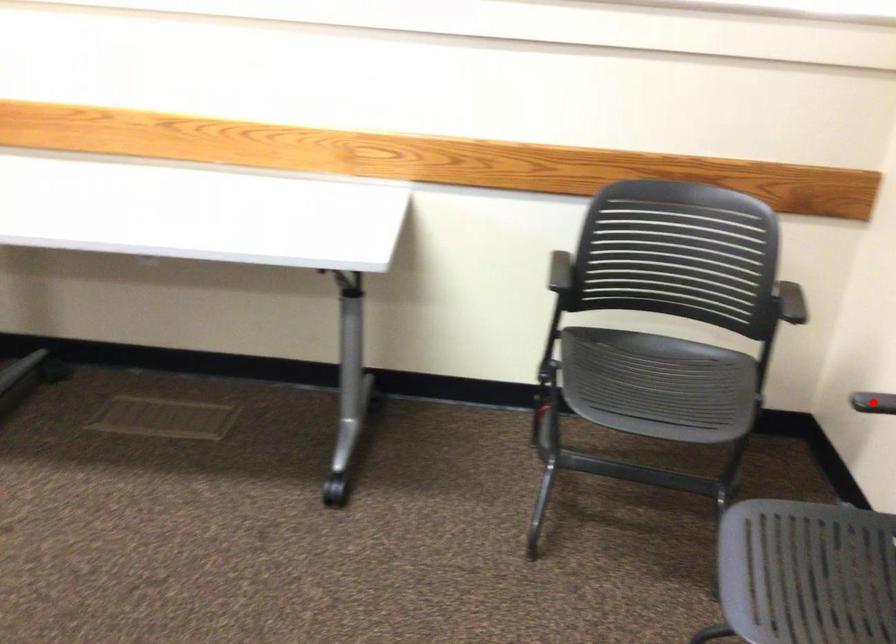
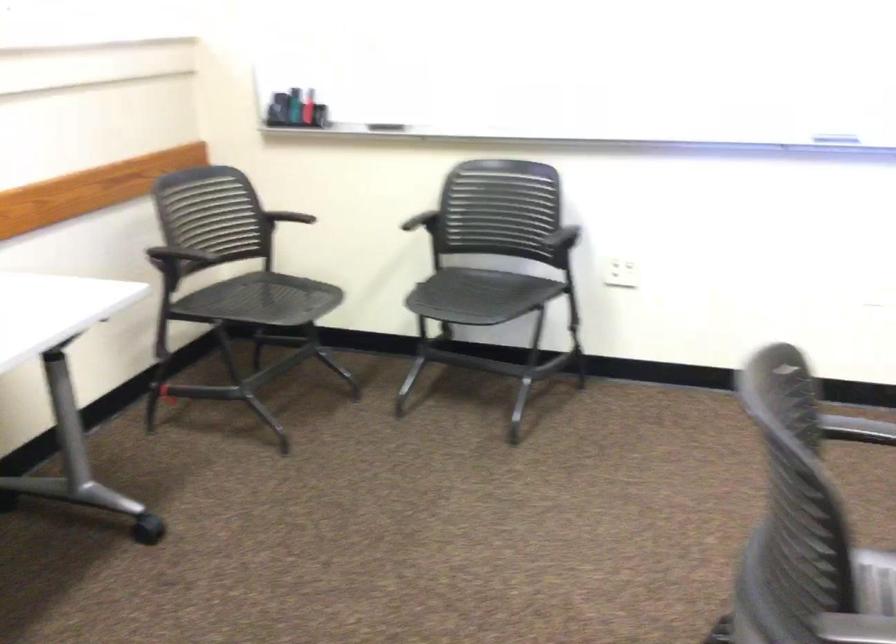
Question: I am providing you with two images of the same scene from different viewpoints. A red point is shown in image1. For the corresponding object point in image2, is it positioned nearer or farther from the camera?

Choices:
 (A) Nearer
 (B) Farther

Answer: (B)